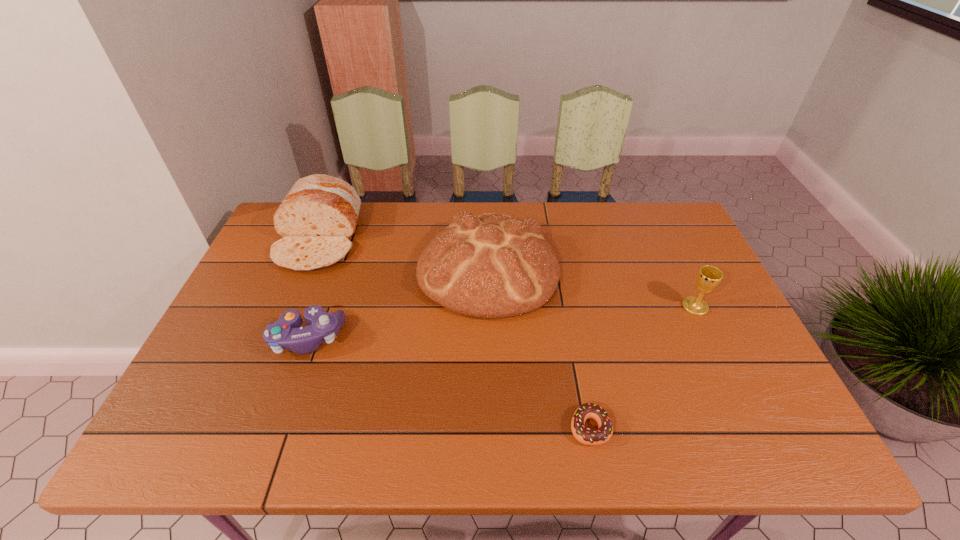
Identify the location of free point located 0.340m on the right of the fourth tallest object. Image resolution: width=960 pixels, height=540 pixels. (478, 338).

The image size is (960, 540). I want to click on blank space located 0.100m on the back of the doughnut, so click(x=579, y=370).

What are the coordinates of `object positioned at the near edge` in the screenshot? It's located at (584, 435).

At what (x,y) coordinates should I click in order to perform the action: click on bread that is at the left edge. Please return your answer as a coordinate pair (x, y). Looking at the image, I should click on (317, 218).

The width and height of the screenshot is (960, 540). In order to click on control that is at the left edge in this screenshot , I will do `click(285, 334)`.

Locate an element on the screen. object that is at the right edge is located at coordinates (708, 278).

This screenshot has height=540, width=960. I want to click on object that is at the far left corner, so click(x=317, y=218).

This screenshot has width=960, height=540. I want to click on vacant region at the far edge of the desktop, so click(610, 205).

I want to click on vacant space at the near edge of the desktop, so click(x=493, y=420).

The image size is (960, 540). In the image, there is a desktop. In order to click on vacant space at the left edge in this screenshot , I will do `click(245, 330)`.